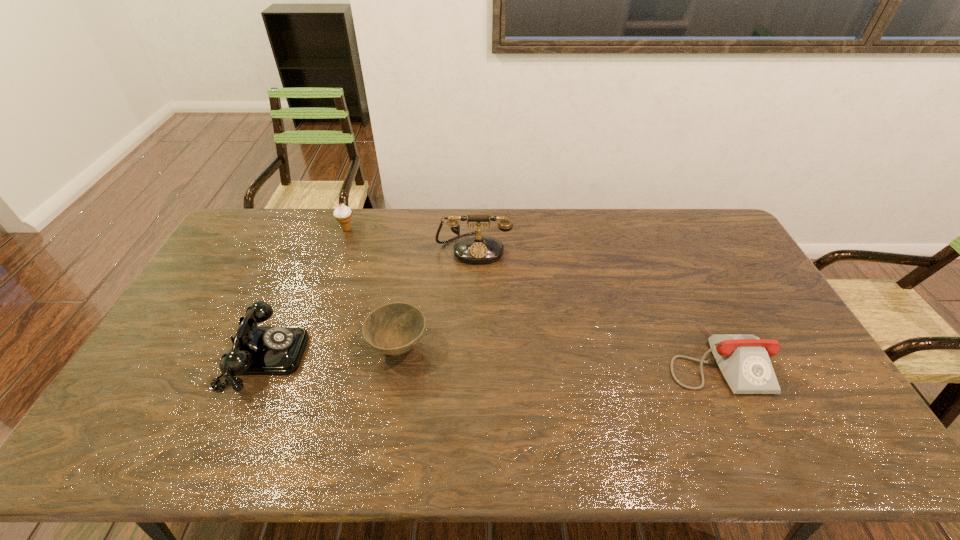
You are a GUI agent. You are given a task and a screenshot of the screen. Output one action in this format:
    pyautogui.click(x=<x>, y=<y>)
    Task: Click on the object that is the second closest one to the bowl
    
    Given the screenshot: What is the action you would take?
    pyautogui.click(x=478, y=249)

Identify the location of the second closest telephone to the icecream. (256, 350).

Image resolution: width=960 pixels, height=540 pixels. I want to click on telephone that stands as the closest to the second tallest telephone, so click(478, 249).

Identify the location of free region that satisfies the following two spatial constraints: 1. on the front side of the icecream; 2. on the right side of the bowl. (305, 347).

Locate an element on the screen. This screenshot has height=540, width=960. vacant space that satisfies the following two spatial constraints: 1. on the dial of the tallest telephone; 2. on the dial of the leftmost telephone is located at coordinates (472, 356).